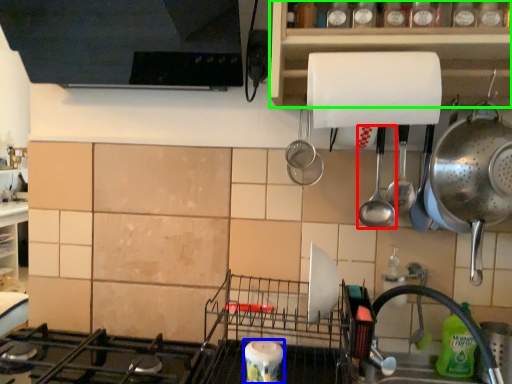
Question: Estimate the real-world distances between objects in this image. Which object is closer to spoon (highlighted by a red box), appliance (highlighted by a blue box) or cabinetry (highlighted by a green box)?

Choices:
 (A) appliance
 (B) cabinetry

Answer: (B)